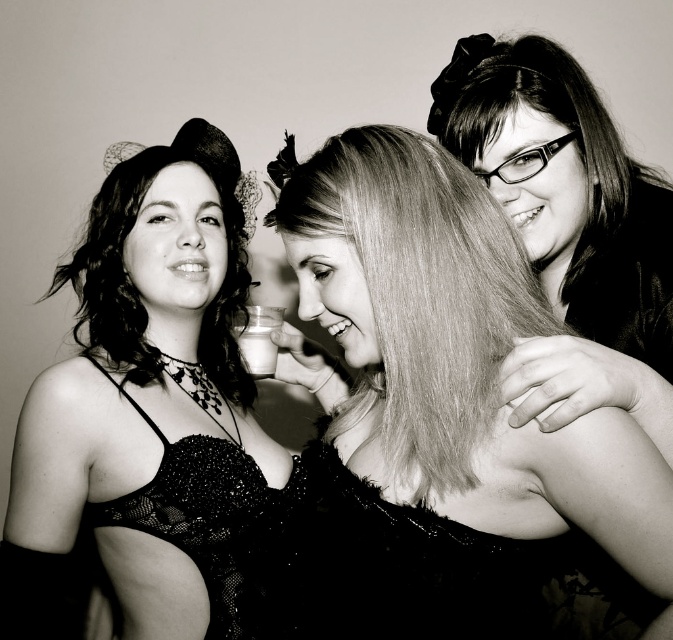
Between black lace bra at left and black sequined dress at center, which one has less height?

With less height is black sequined dress at center.

In the scene shown: Does black lace bra at left have a greater width compared to black sequined dress at center?

Incorrect, black lace bra at left's width does not surpass black sequined dress at center's.

Which is behind, point (26, 620) or point (369, 600)?

The point (26, 620) is behind.

Identify the location of black lace bra at left. (153, 417).

Who is more distant from viewer, (627,579) or (470,115)?

The point (470,115) is more distant.

Does black sequined dress at center have a larger size compared to smooth black hair at upper right?

Correct, black sequined dress at center is larger in size than smooth black hair at upper right.

Does point (505, 602) lie behind point (491, 67)?

No, (505, 602) is in front of (491, 67).

Where is `black sequined dress at center`? This screenshot has width=673, height=640. black sequined dress at center is located at coordinates (439, 570).

Is smooth hair at center above black lace bra at left?

No.

Is smooth hair at center shorter than black lace bra at left?

Yes, smooth hair at center is shorter than black lace bra at left.

Is point (668, 563) farther from viewer compared to point (110, 173)?

No, (668, 563) is in front of (110, 173).

This screenshot has height=640, width=673. What are the coordinates of `smooth hair at center` in the screenshot? It's located at (444, 388).